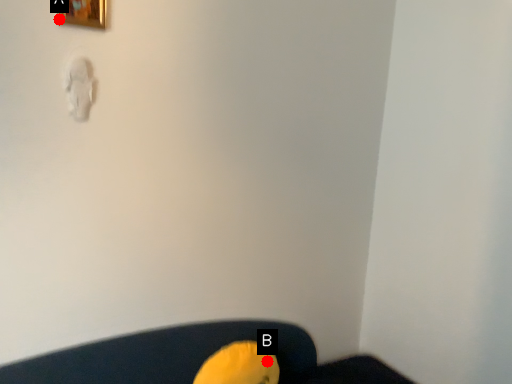
Question: Two points are circled on the image, labeled by A and B beside each circle. Which of the following is the farthest from the observer?

Choices:
 (A) A is further
 (B) B is further

Answer: (B)